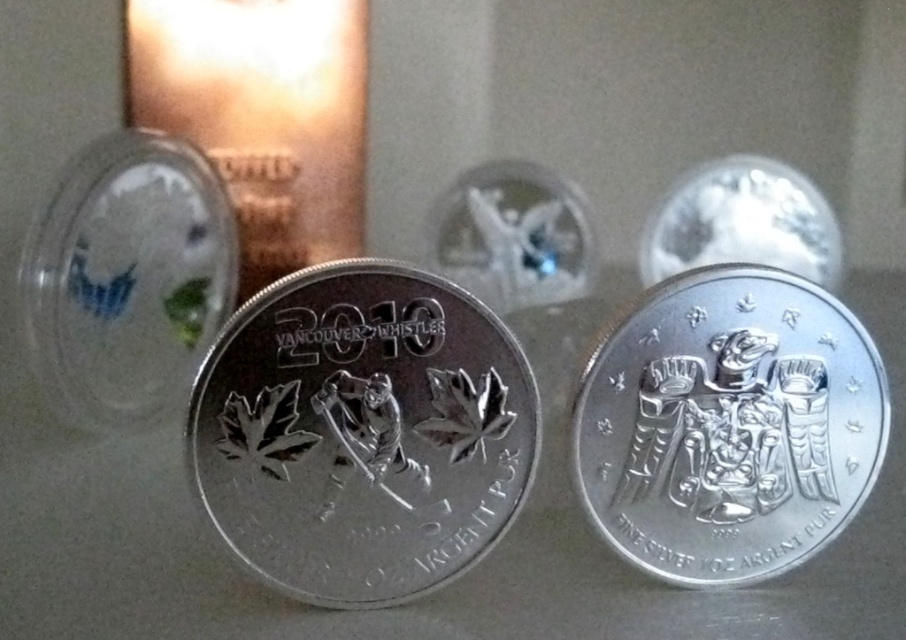
Question: Is silver/metallic coin at center smaller than silver/metallic eagle at center?

Choices:
 (A) yes
 (B) no

Answer: (B)

Question: From the image, what is the correct spatial relationship of silver/metallic coin at center in relation to silver/metallic eagle at center?

Choices:
 (A) below
 (B) above

Answer: (A)

Question: Which point appears farthest from the camera in this image?

Choices:
 (A) (827, 481)
 (B) (357, 460)

Answer: (A)

Question: Can you confirm if silver/metallic coin at center is bigger than silver/metallic eagle at center?

Choices:
 (A) yes
 (B) no

Answer: (A)

Question: Which point appears farthest from the camera in this image?

Choices:
 (A) pyautogui.click(x=496, y=358)
 (B) pyautogui.click(x=672, y=365)

Answer: (B)